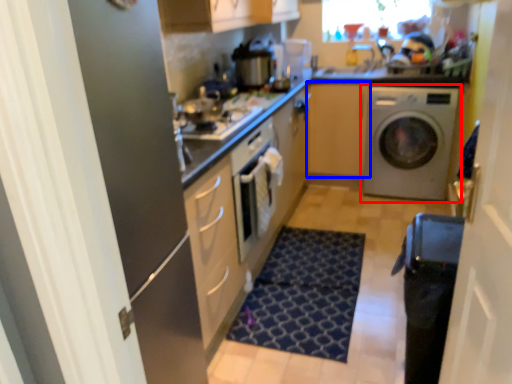
Question: Which object is closer to the camera taking this photo, washing machine (highlighted by a red box) or cabinetry (highlighted by a blue box)?

Choices:
 (A) washing machine
 (B) cabinetry

Answer: (A)